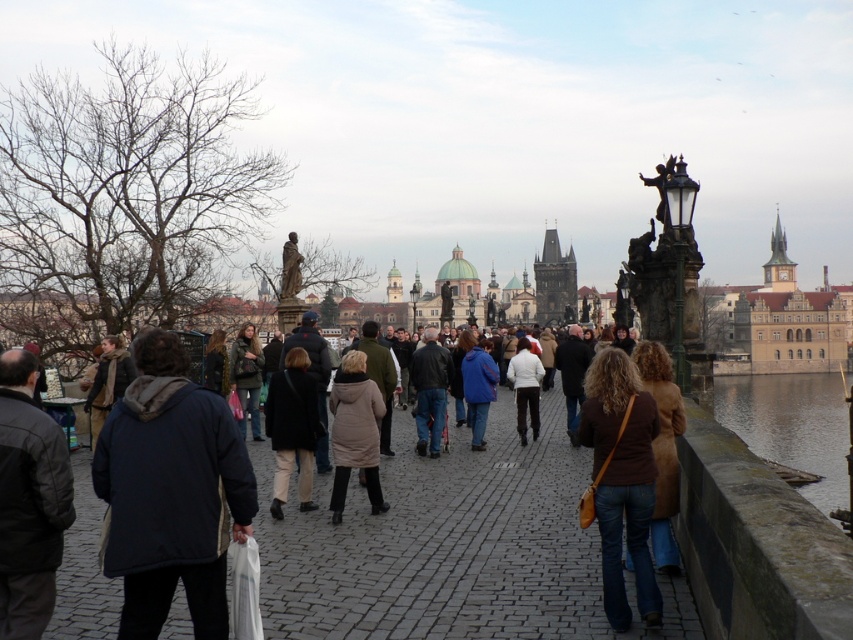
Question: Considering the real-world distances, which object is closest to the matte black coat at center?

Choices:
 (A) white matte jacket at center
 (B) brown leather jacket at center
 (C) blue fabric jacket at center

Answer: (C)

Question: Does dark gray leather jacket at left appear on the right side of beige wool coat at center?

Choices:
 (A) yes
 (B) no

Answer: (B)

Question: Which point appears farthest from the camera in this image?

Choices:
 (A) (786, 396)
 (B) (256, 378)

Answer: (A)

Question: In this image, where is beige wool coat at center located relative to white matte jacket at center?

Choices:
 (A) below
 (B) above

Answer: (A)

Question: Is dark blue jacket at left in front of matte black coat at center?

Choices:
 (A) no
 (B) yes

Answer: (B)

Question: Which point is closer to the camera taking this photo?

Choices:
 (A) (519, 387)
 (B) (236, 390)
 (C) (30, 602)
 (D) (814, 396)

Answer: (C)